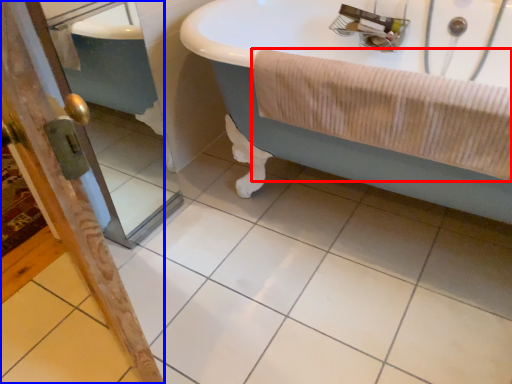
Question: Which of the following is the closest to the observer, bath towel (highlighted by a red box) or screen door (highlighted by a blue box)?

Choices:
 (A) bath towel
 (B) screen door

Answer: (A)